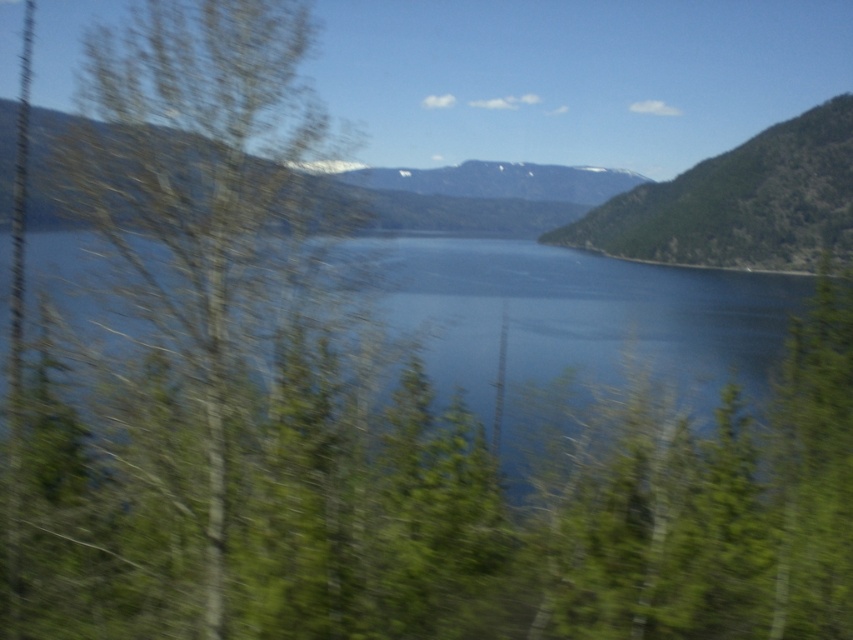
You are standing in the scenic area and want to take a photo of the green leafy tree at left and the green textured hillside at upper right. Which object should you focus on first if you want both to be in sharp focus?

The green leafy tree at left is positioned under the green textured hillside at upper right, so you should focus on the green leafy tree at left first to ensure both are in sharp focus.

From the picture: You are a painter standing in the foreground of the scene. You want to paint the green leafy tree at left and the blue water at center. Which object should you focus on more in terms of size in your painting to accurately represent their proportions?

The blue water at center occupies more space in the scene than the green leafy tree at left, so you should focus on making the blue water at center larger in your painting to accurately represent their proportions.

You are a landscape painter planning to create a painting of the scene. You want to ensure that the blue water at center and the green textured hillside at upper right are proportionally accurate. Which object should you make larger in your painting?

The green textured hillside at upper right should be made larger in the painting since it occupies more space than the blue water at center in the original scene.